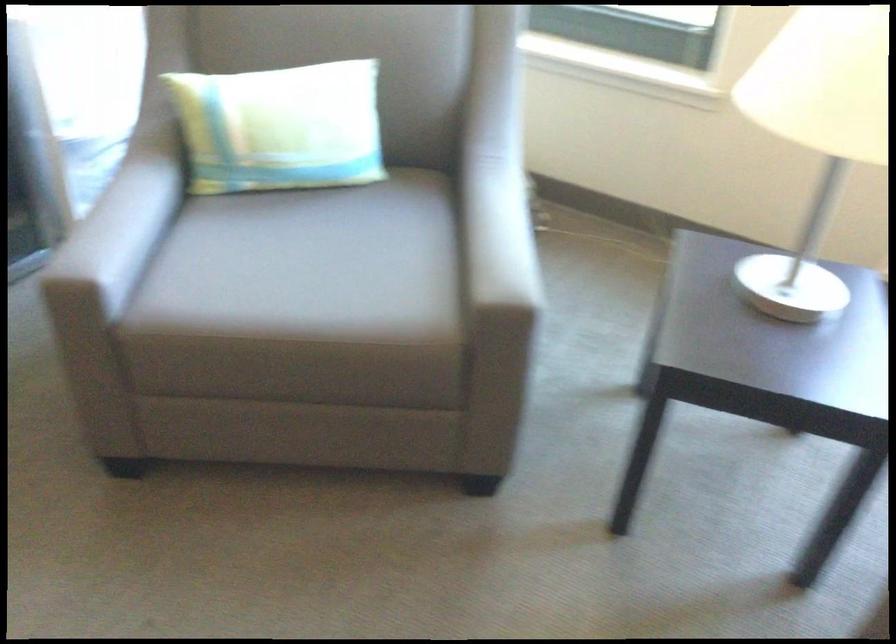
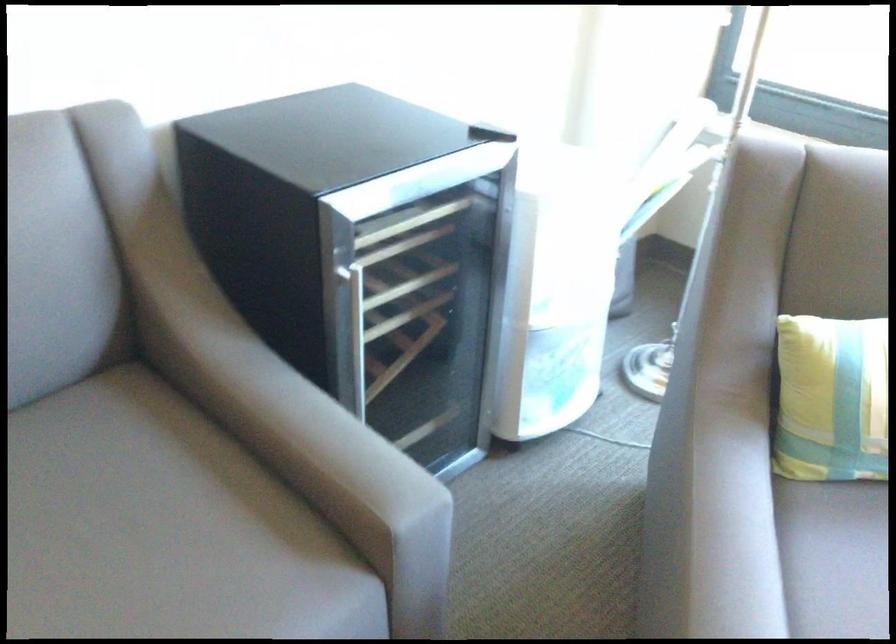
In the second image, find the point that corresponds to point (84, 209) in the first image.

(711, 522)